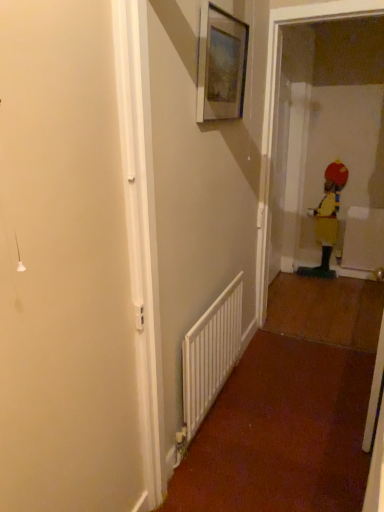
Question: Is white plastic radiator at center turned away from yellow fabric toddler at right?

Choices:
 (A) yes
 (B) no

Answer: (B)

Question: Would you say white plastic radiator at center is a long distance from yellow fabric toddler at right?

Choices:
 (A) yes
 (B) no

Answer: (A)

Question: Does white plastic radiator at center have a smaller size compared to yellow fabric toddler at right?

Choices:
 (A) no
 (B) yes

Answer: (B)

Question: From a real-world perspective, is white plastic radiator at center over yellow fabric toddler at right?

Choices:
 (A) yes
 (B) no

Answer: (B)

Question: Does white plastic radiator at center come behind yellow fabric toddler at right?

Choices:
 (A) no
 (B) yes

Answer: (A)

Question: Looking at their shapes, would you say yellow fabric toddler at right is wider or thinner than matte wooden picture frame at upper center?

Choices:
 (A) wide
 (B) thin

Answer: (A)

Question: From a real-world perspective, relative to matte wooden picture frame at upper center, is yellow fabric toddler at right vertically above or below?

Choices:
 (A) above
 (B) below

Answer: (B)

Question: Considering their positions, is yellow fabric toddler at right located in front of or behind matte wooden picture frame at upper center?

Choices:
 (A) behind
 (B) front

Answer: (A)

Question: From the image's perspective, is yellow fabric toddler at right above or below matte wooden picture frame at upper center?

Choices:
 (A) below
 (B) above

Answer: (A)

Question: Do you think white plastic radiator at center is within yellow fabric toddler at right, or outside of it?

Choices:
 (A) inside
 (B) outside

Answer: (B)

Question: From a real-world perspective, relative to yellow fabric toddler at right, is white plastic radiator at center vertically above or below?

Choices:
 (A) below
 (B) above

Answer: (A)

Question: Is white plastic radiator at center wider or thinner than yellow fabric toddler at right?

Choices:
 (A) thin
 (B) wide

Answer: (A)

Question: From their relative heights in the image, would you say white plastic radiator at center is taller or shorter than yellow fabric toddler at right?

Choices:
 (A) short
 (B) tall

Answer: (A)

Question: Is yellow fabric toddler at right spatially inside white plastic radiator at center, or outside of it?

Choices:
 (A) inside
 (B) outside

Answer: (B)

Question: From the image's perspective, is yellow fabric toddler at right located above or below white plastic radiator at center?

Choices:
 (A) above
 (B) below

Answer: (A)